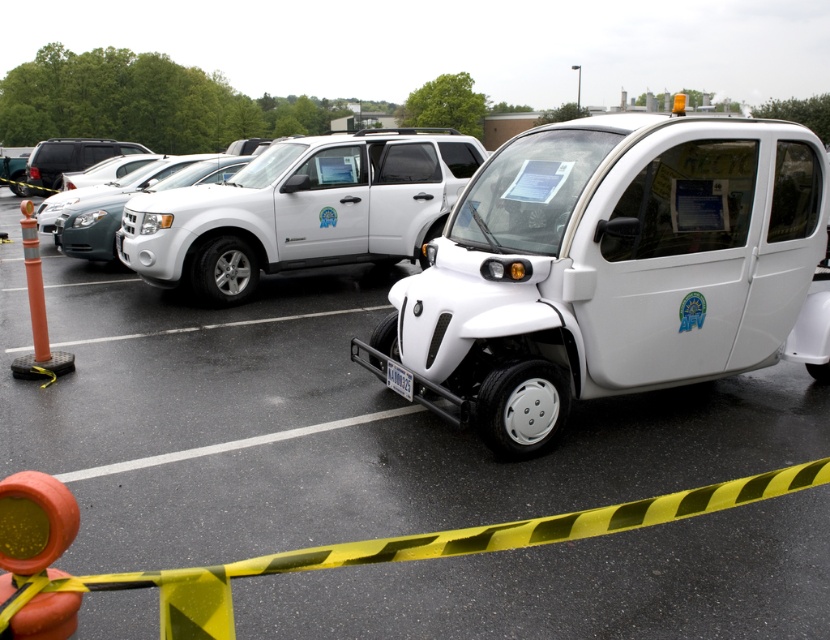
Who is shorter, white matte electric car at center or white matte suv at upper center?

white matte electric car at center is shorter.

Which is in front, point (594, 317) or point (271, 269)?

Positioned in front is point (594, 317).

The width and height of the screenshot is (830, 640). Identify the location of white matte electric car at center. (608, 269).

What do you see at coordinates (301, 211) in the screenshot? This screenshot has width=830, height=640. I see `white matte suv at upper center` at bounding box center [301, 211].

Does white matte suv at upper center appear on the left side of white matte suv at center?

In fact, white matte suv at upper center is to the right of white matte suv at center.

Does point (355, 192) come farther from viewer compared to point (77, 234)?

That is False.

Find the location of `white matte suv at upper center`. white matte suv at upper center is located at coordinates pyautogui.click(x=301, y=211).

Can you confirm if white matte electric car at center is positioned to the right of white matte suv at center?

Correct, you'll find white matte electric car at center to the right of white matte suv at center.

Find the location of a particular element. white matte electric car at center is located at coordinates (608, 269).

Locate an element on the screen. The image size is (830, 640). white matte electric car at center is located at coordinates (608, 269).

Locate an element on the screen. white matte electric car at center is located at coordinates (608, 269).